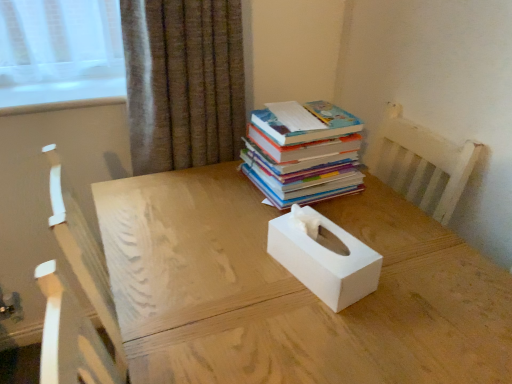
I want to click on vacant space behind white matte tissue box at center, so pos(316,208).